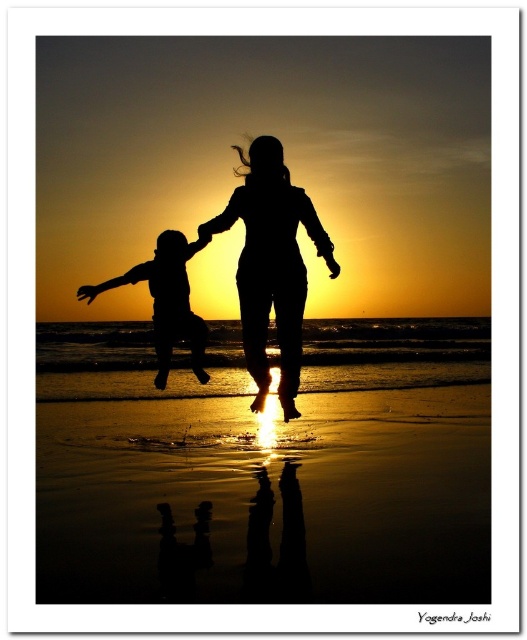
Does shiny sand beach at lower center have a larger size compared to silhouette figure at center?

Correct, shiny sand beach at lower center is larger in size than silhouette figure at center.

Does shiny sand beach at lower center have a greater width compared to silhouette figure at center?

Correct, the width of shiny sand beach at lower center exceeds that of silhouette figure at center.

The width and height of the screenshot is (527, 640). What are the coordinates of `shiny sand beach at lower center` in the screenshot? It's located at coord(266,499).

Is silhouette figure at center above matte black figure at left?

Correct, silhouette figure at center is located above matte black figure at left.

The height and width of the screenshot is (640, 527). Find the location of `silhouette figure at center`. silhouette figure at center is located at coordinates (271, 264).

The width and height of the screenshot is (527, 640). What are the coordinates of `silhouette figure at center` in the screenshot? It's located at (271, 264).

Who is lower down, shiny sand beach at lower center or matte black figure at left?

shiny sand beach at lower center is lower down.

Can you confirm if shiny sand beach at lower center is positioned to the left of matte black figure at left?

No, shiny sand beach at lower center is not to the left of matte black figure at left.

Which is in front, point (434, 397) or point (189, 320)?

Point (189, 320) is in front.

Locate an element on the screen. The width and height of the screenshot is (527, 640). shiny sand beach at lower center is located at coordinates (266, 499).